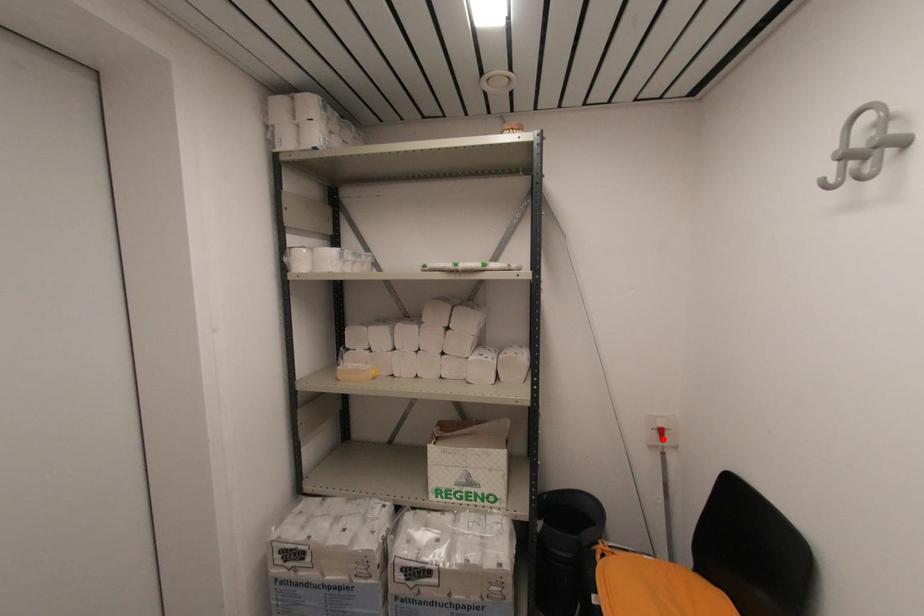
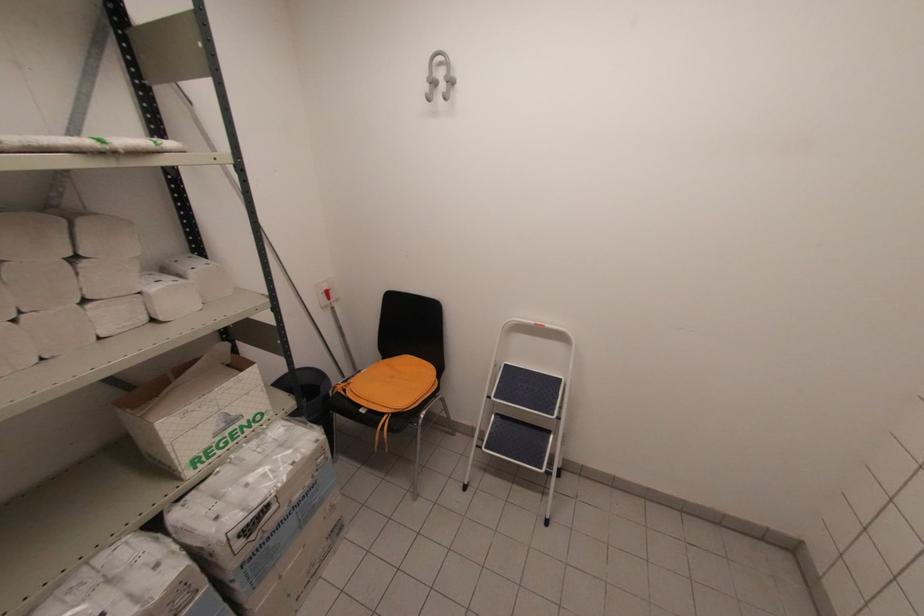
Locate, in the second image, the point that corresponds to the highlighted location in the first image.

(330, 299)